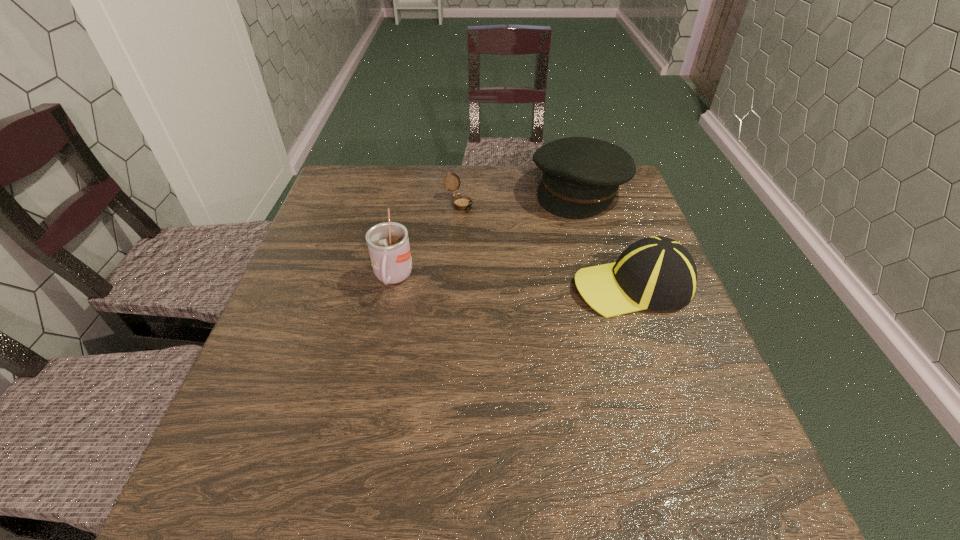
Find the location of a particular element. unoccupied position between the baseball cap and the leftmost object is located at coordinates (513, 282).

Find the location of a particular element. free spot between the second object from left to right and the leftmost object is located at coordinates (426, 241).

This screenshot has height=540, width=960. In order to click on free space that is in between the beret and the leftmost object in this screenshot , I will do `click(486, 234)`.

Identify the location of free area in between the leftmost object and the compass. The image size is (960, 540). (x=426, y=241).

You are a GUI agent. You are given a task and a screenshot of the screen. Output one action in this format:
    pyautogui.click(x=<x>, y=<y>)
    Task: Click on the free space between the compass and the beret
    
    Given the screenshot: What is the action you would take?
    pyautogui.click(x=519, y=196)

Identify the location of free spot between the beret and the leftmost object. (486, 234).

Image resolution: width=960 pixels, height=540 pixels. In order to click on the closest object to the baseball cap in this screenshot , I will do `click(581, 176)`.

Where is `object that stands as the third closest to the compass`? object that stands as the third closest to the compass is located at coordinates (658, 273).

The image size is (960, 540). I want to click on vacant space that satisfies the following two spatial constraints: 1. on the side with the handle of the leftmost object; 2. with the brim of the baseball cap facing forward, so click(x=392, y=285).

At what (x,y) coordinates should I click in order to perform the action: click on free spot that satisfies the following two spatial constraints: 1. on the front side of the baseball cap; 2. with the brim of the shortest object facing forward. Please return your answer as a coordinate pair (x, y). Looking at the image, I should click on (454, 285).